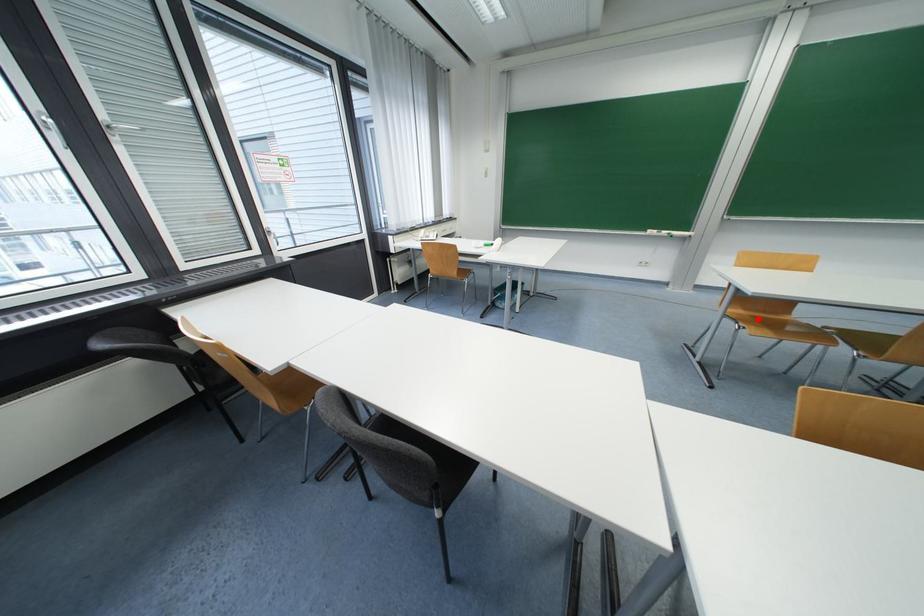
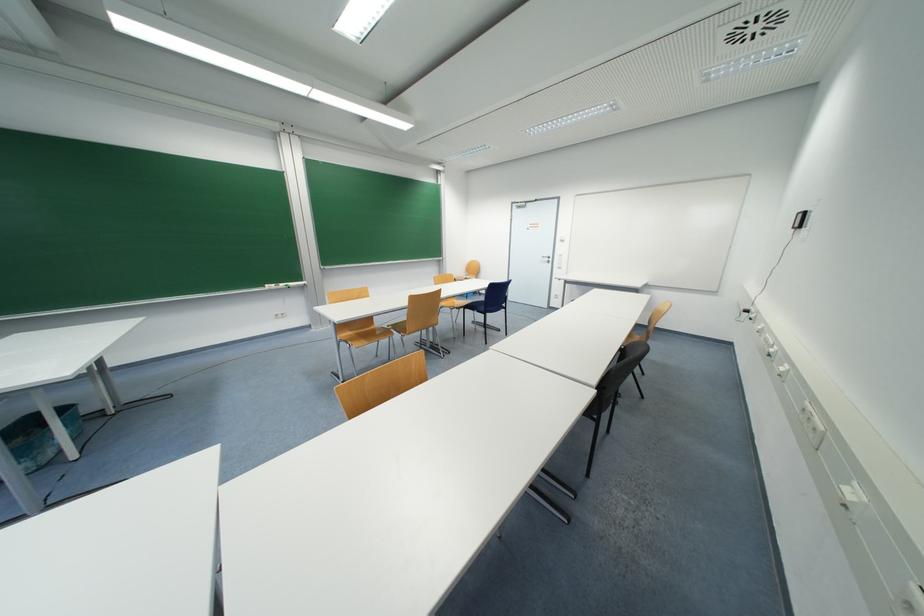
In the second image, find the point that corresponds to the highlighted location in the first image.

(361, 336)